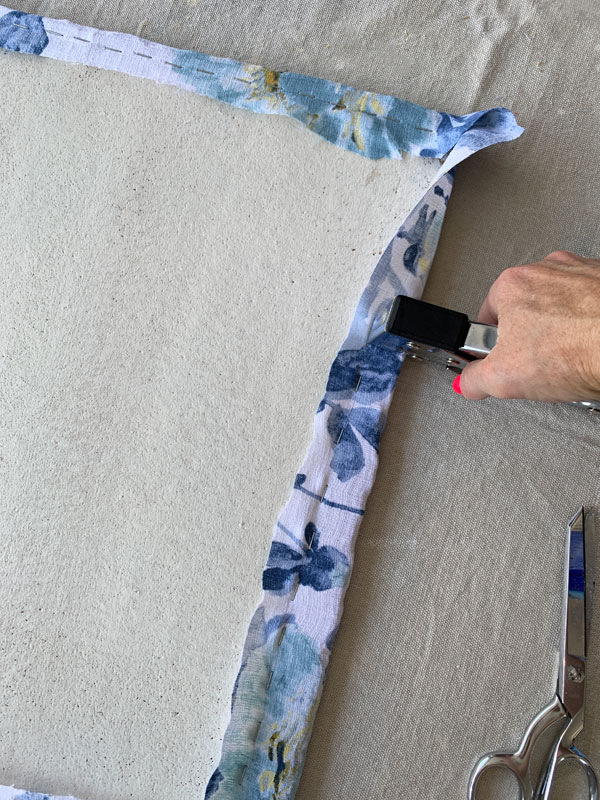
Locate an element on the screen. This screenshot has width=600, height=800. blue flowered fabric is located at coordinates (310, 578).